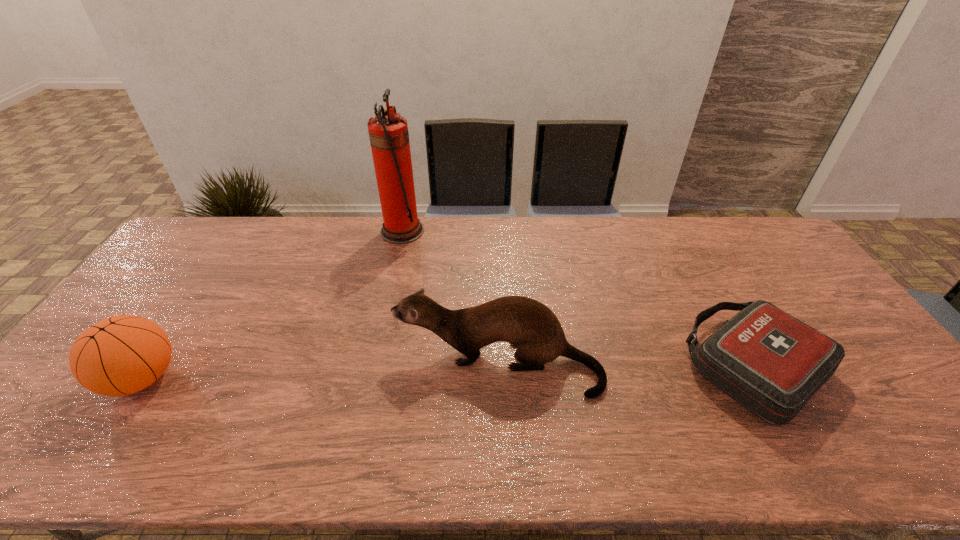
Find the location of a particular element. free location located on the back of the basketball is located at coordinates (210, 277).

Where is `vacant space located on the left of the shortest object`? The height and width of the screenshot is (540, 960). vacant space located on the left of the shortest object is located at coordinates (552, 367).

Locate an element on the screen. object that is at the far edge is located at coordinates (388, 133).

Find the location of a particular element. Image resolution: width=960 pixels, height=540 pixels. object at the near edge is located at coordinates (771, 363).

I want to click on object at the left edge, so click(x=121, y=355).

At what (x,y) coordinates should I click in order to perform the action: click on object at the right edge. Please return your answer as a coordinate pair (x, y). The width and height of the screenshot is (960, 540). Looking at the image, I should click on (771, 363).

This screenshot has width=960, height=540. I want to click on object that is at the near right corner, so click(771, 363).

This screenshot has width=960, height=540. In the image, there is a desktop. What are the coordinates of `vacant area at the far edge` in the screenshot? It's located at click(584, 237).

Image resolution: width=960 pixels, height=540 pixels. Find the location of `free space at the near edge of the desktop`. free space at the near edge of the desktop is located at coordinates (394, 437).

In the image, there is a desktop. At what (x,y) coordinates should I click in order to perform the action: click on vacant region at the left edge. Please return your answer as a coordinate pair (x, y). Looking at the image, I should click on (160, 285).